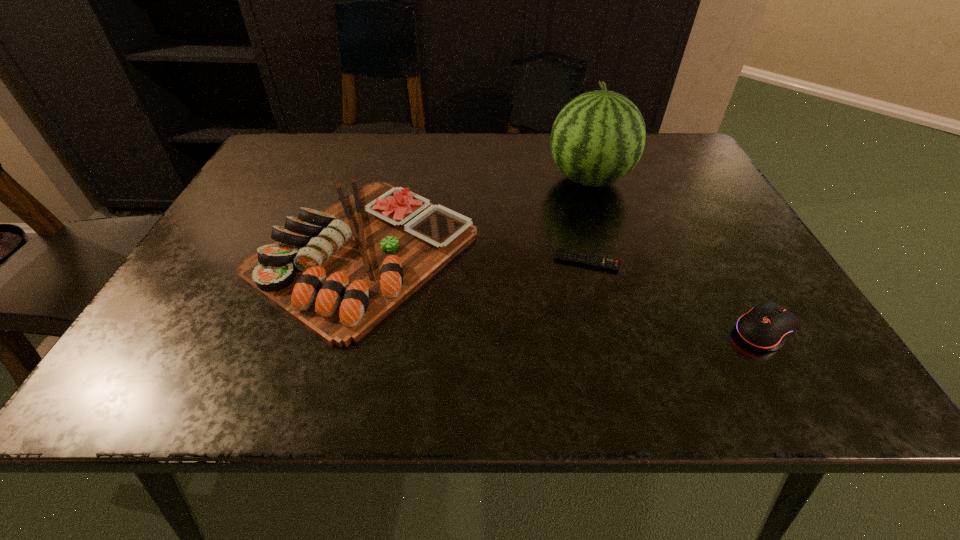
Where is `free space between the computer mouse and the third shortest object`? This screenshot has height=540, width=960. free space between the computer mouse and the third shortest object is located at coordinates (564, 291).

Find the location of a particular element. free spot between the remote control and the watermelon is located at coordinates (588, 220).

Where is `free spot between the leftmost object and the rightmost object`? This screenshot has width=960, height=540. free spot between the leftmost object and the rightmost object is located at coordinates (564, 291).

At what (x,y) coordinates should I click in order to perform the action: click on unoccupied area between the remote control and the tallest object. Please return your answer as a coordinate pair (x, y). The height and width of the screenshot is (540, 960). Looking at the image, I should click on (588, 220).

Where is `vacant area that lies between the remote control and the leftmost object`? vacant area that lies between the remote control and the leftmost object is located at coordinates (475, 256).

Identify the location of vacant space that's between the computer mouse and the shortest object. (676, 295).

Find the location of a particular element. The width and height of the screenshot is (960, 540). free space that is in between the third shortest object and the tallest object is located at coordinates (476, 215).

Find the location of a particular element. Image resolution: width=960 pixels, height=540 pixels. vacant space that's between the watermelon and the remote control is located at coordinates (588, 220).

This screenshot has width=960, height=540. I want to click on free point between the rightmost object and the remote control, so click(676, 295).

You are a GUI agent. You are given a task and a screenshot of the screen. Output one action in this format:
    pyautogui.click(x=<x>, y=<y>)
    Task: Click on the free space between the watermelon and the shortest object
    
    Given the screenshot: What is the action you would take?
    pyautogui.click(x=588, y=220)